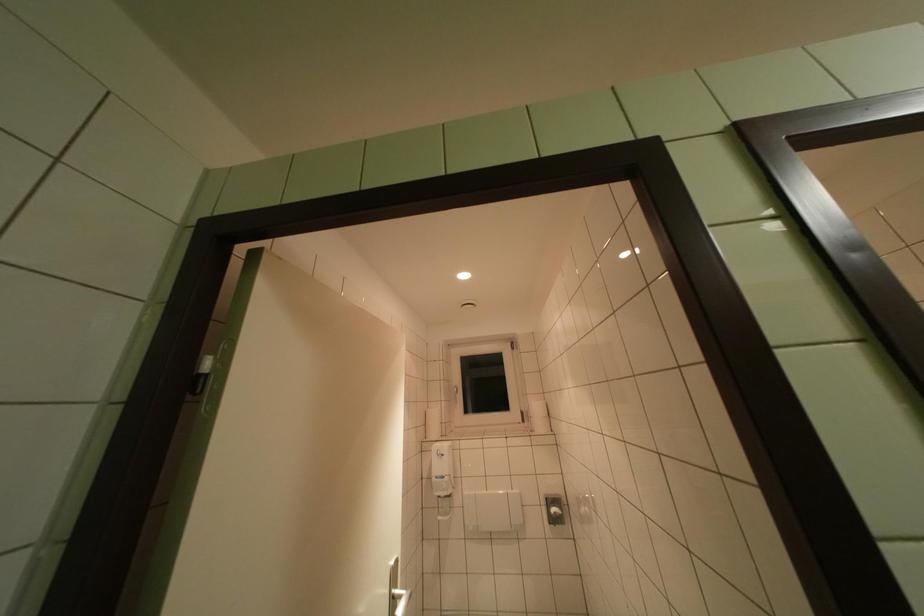
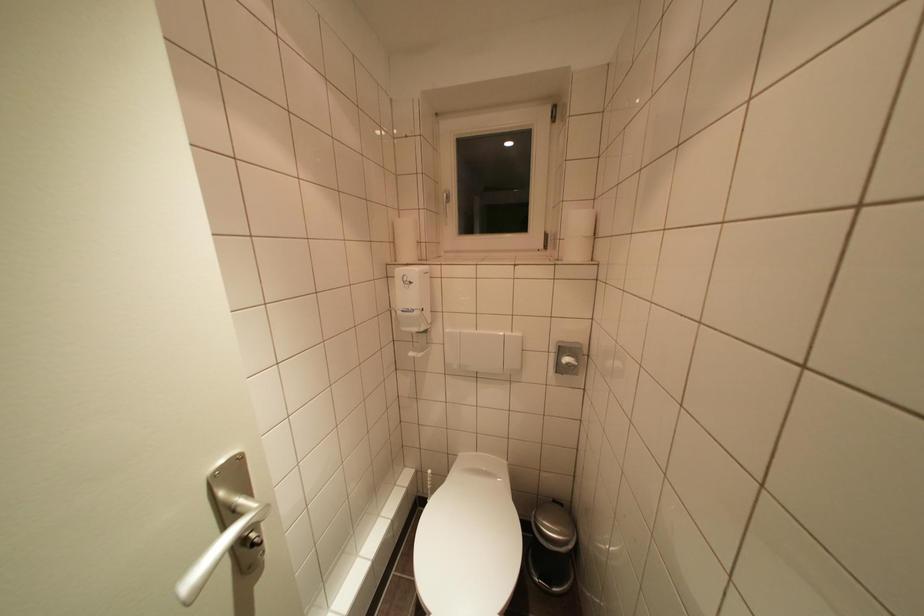
Where in the second image is the point corresponding to [542,411] from the first image?

(581, 225)